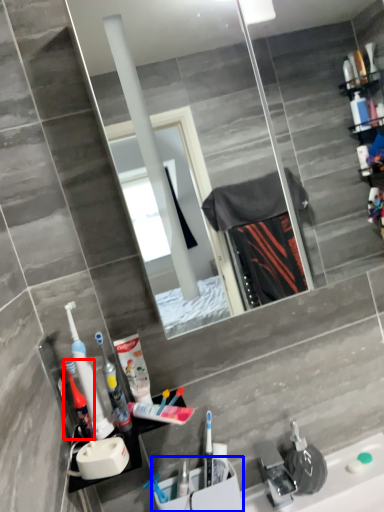
Question: Among these objects, which one is farthest to the camera, mouthwash (highlighted by a red box) or sink (highlighted by a blue box)?

Choices:
 (A) mouthwash
 (B) sink

Answer: (B)